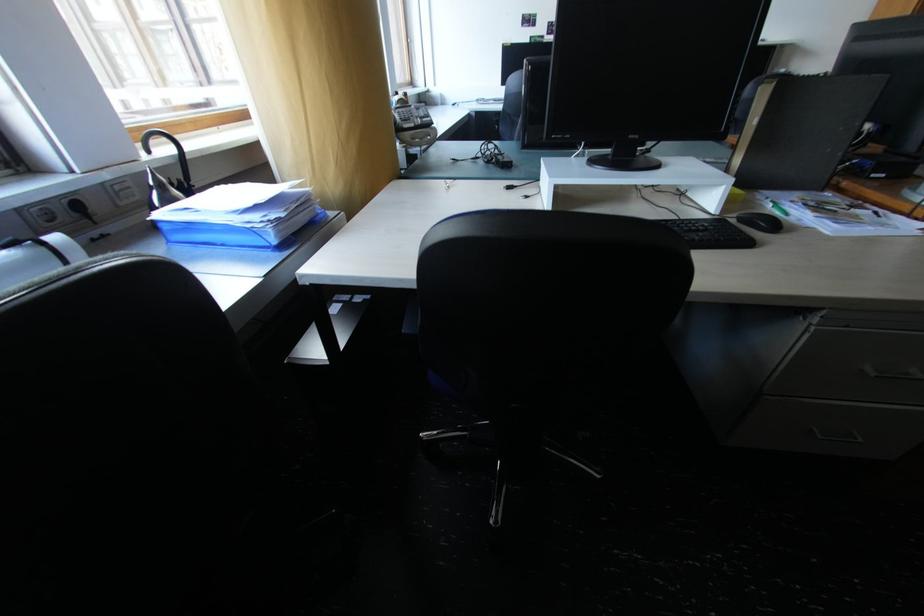
Where is `power strip switch`? This screenshot has width=924, height=616. power strip switch is located at coordinates (69, 221).